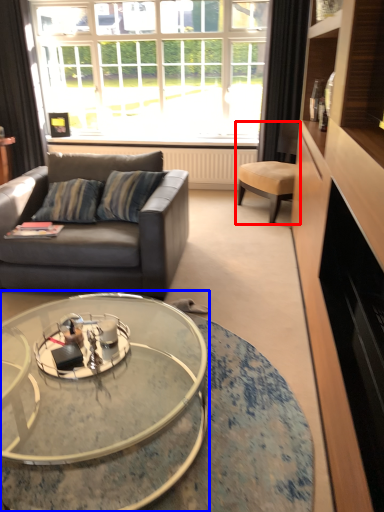
Question: Which point is closer to the camera, chair (highlighted by a red box) or coffee table (highlighted by a blue box)?

Choices:
 (A) chair
 (B) coffee table

Answer: (B)